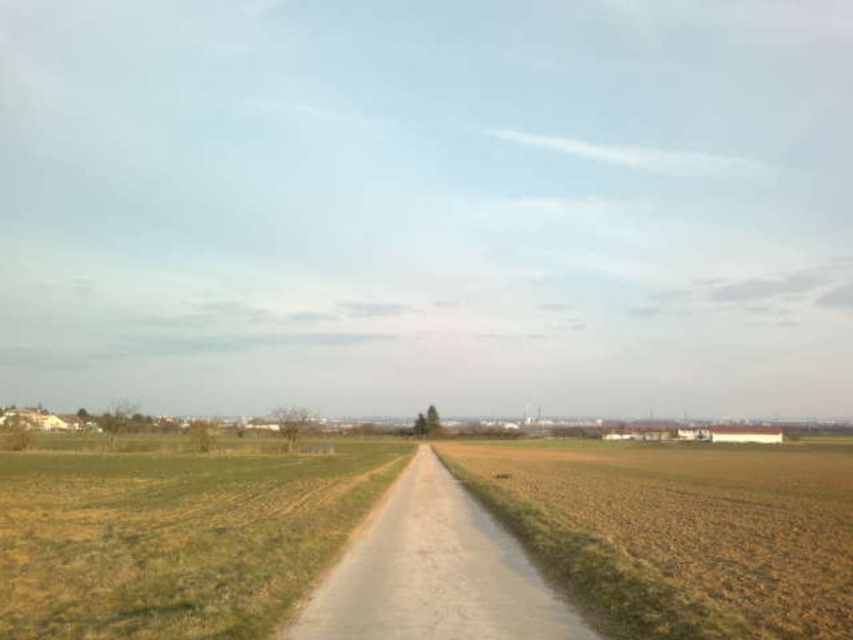
Between green grass at lower left and dull gray gravel road at center, which one is positioned higher?

Positioned higher is dull gray gravel road at center.

Does green grass at lower left have a greater width compared to dull gray gravel road at center?

Yes.

The image size is (853, 640). Describe the element at coordinates (173, 538) in the screenshot. I see `green grass at lower left` at that location.

Find the location of a particular element. green grass at lower left is located at coordinates (173, 538).

Does brown soil field at lower right have a greater width compared to green grass at lower left?

Correct, the width of brown soil field at lower right exceeds that of green grass at lower left.

Can you confirm if brown soil field at lower right is shorter than green grass at lower left?

In fact, brown soil field at lower right may be taller than green grass at lower left.

What do you see at coordinates (677, 532) in the screenshot? The height and width of the screenshot is (640, 853). I see `brown soil field at lower right` at bounding box center [677, 532].

I want to click on brown soil field at lower right, so click(677, 532).

Looking at this image, between brown soil field at lower right and dull gray gravel road at center, which one has more height?

With more height is brown soil field at lower right.

From the picture: Does brown soil field at lower right have a lesser height compared to dull gray gravel road at center?

No.

Is point (610, 536) positioned after point (523, 636)?

Yes, point (610, 536) is behind point (523, 636).

Identify the location of brown soil field at lower right. click(x=677, y=532).